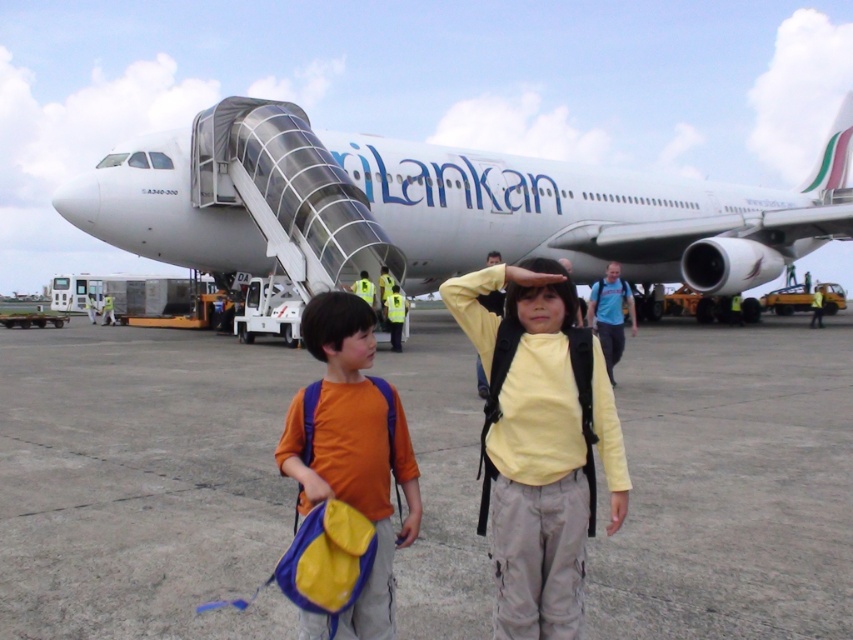
You are a photographer at the airport tarmac. You want to take a photo of the yellow matte shirt at center. Where should you aim your camera to capture it?

You should aim your camera at point (538,445) to capture the yellow matte shirt at center.

You are a photographer standing on the gray concrete tarmac at center and want to take a photo of the yellow matte shirt at center. Since you need to focus your camera properly, can you tell me which object is closer to you?

The gray concrete tarmac at center is further to the viewer than yellow matte shirt at center, so the yellow matte shirt at center is closer to you.